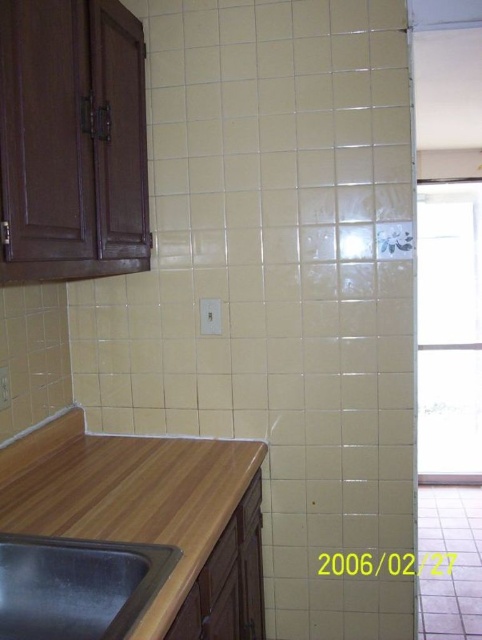
You are a plumber trying to fix a leak under the black stainless steel sink at lower left. You need to access the pipes located under the wooden counter at lower left. Can you reach the pipes by crawling under the sink? Explain your reasoning based on their positions.

The wooden counter at lower left is positioned under the black stainless steel sink at lower left, so the pipes under the wooden counter at lower left would be accessible by crawling under the sink. Therefore, yes, you can reach the pipes by crawling under the black stainless steel sink at lower left.

You are standing in the kitchen and want to place a small plant between the two points, point (209, 529) and point (86, 547). Since you want the plant to be closer to the front of the kitchen, which point should you position it near?

You should position the plant near point (86, 547) because it is in front of point (209, 529).